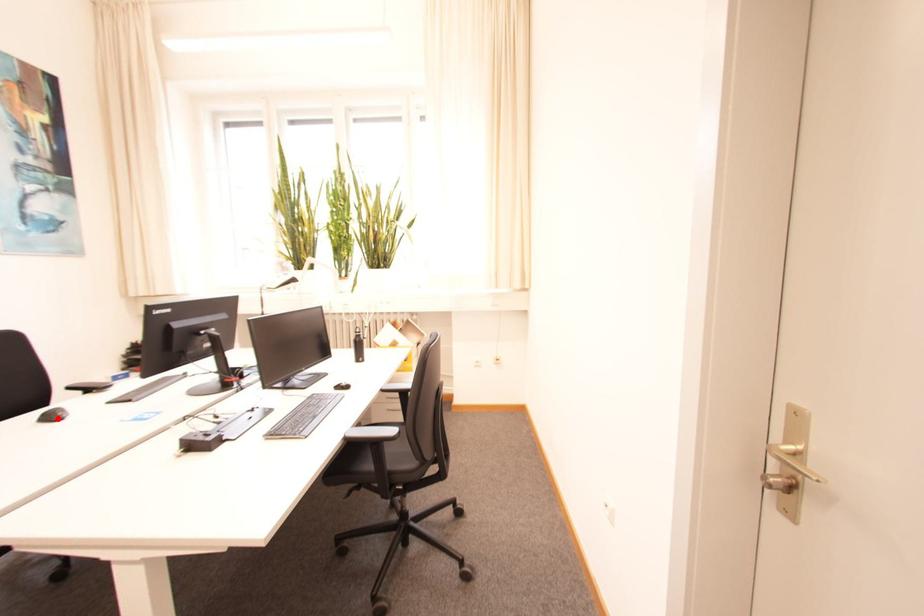
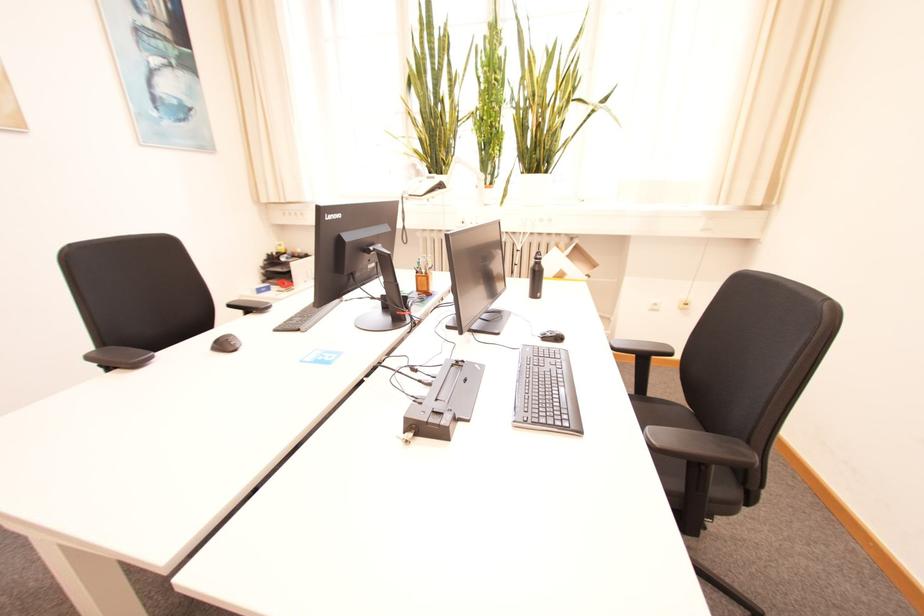
In the second image, find the point that corresponds to the highlighted location in the first image.

(229, 346)